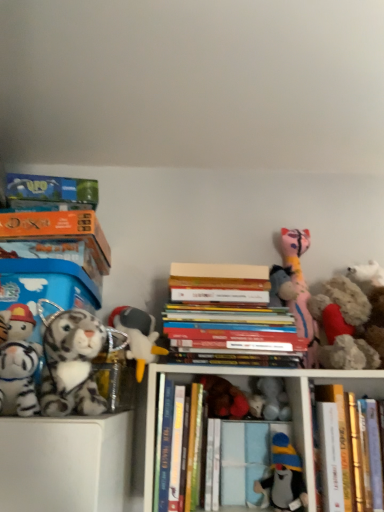
Question: Is white plush toy at center-left, the 3th toy when ordered from left to right, at the right side of fluffy white teddy bear at right, the 1th toy when ordered from right to left?

Choices:
 (A) yes
 (B) no

Answer: (B)

Question: Is white plush toy at center-left, the 3th toy when ordered from left to right, taller than fluffy white teddy bear at right, placed as the 9th toy when sorted from left to right?

Choices:
 (A) no
 (B) yes

Answer: (A)

Question: Is white plush toy at center-left, the 3th toy when ordered from left to right, not near fluffy white teddy bear at right, placed as the 9th toy when sorted from left to right?

Choices:
 (A) no
 (B) yes

Answer: (A)

Question: From a real-world perspective, is white plush toy at center-left, the 3th toy when ordered from left to right, on top of fluffy white teddy bear at right, placed as the 9th toy when sorted from left to right?

Choices:
 (A) no
 (B) yes

Answer: (A)

Question: From the image's perspective, is white plush toy at center-left, the 3th toy when ordered from left to right, located above fluffy white teddy bear at right, the 1th toy when ordered from right to left?

Choices:
 (A) no
 (B) yes

Answer: (A)

Question: From the image's perspective, would you say white plush toy at center-left, acting as the seventh toy starting from the right, is shown under fluffy white teddy bear at right, placed as the 9th toy when sorted from left to right?

Choices:
 (A) no
 (B) yes

Answer: (B)

Question: Can you confirm if white plush tiger at left, acting as the eighth toy starting from the right, is taller than matte pink plush cat at upper right, the seventh toy viewed from the left?

Choices:
 (A) no
 (B) yes

Answer: (A)

Question: Considering the relative sizes of white plush tiger at left, acting as the eighth toy starting from the right, and matte pink plush cat at upper right, the seventh toy viewed from the left, in the image provided, is white plush tiger at left, acting as the eighth toy starting from the right, shorter than matte pink plush cat at upper right, the seventh toy viewed from the left,?

Choices:
 (A) yes
 (B) no

Answer: (A)

Question: Does white plush tiger at left, which ranks as the 2th toy in left-to-right order, appear on the right side of matte pink plush cat at upper right, the seventh toy viewed from the left?

Choices:
 (A) no
 (B) yes

Answer: (A)

Question: Is white plush tiger at left, acting as the eighth toy starting from the right, not near matte pink plush cat at upper right, placed as the 3th toy when sorted from right to left?

Choices:
 (A) yes
 (B) no

Answer: (B)

Question: From the image's perspective, would you say white plush tiger at left, acting as the eighth toy starting from the right, is shown under matte pink plush cat at upper right, placed as the 3th toy when sorted from right to left?

Choices:
 (A) no
 (B) yes

Answer: (B)

Question: Does white plush tiger at left, which ranks as the 2th toy in left-to-right order, have a greater width compared to matte pink plush cat at upper right, the seventh toy viewed from the left?

Choices:
 (A) no
 (B) yes

Answer: (B)

Question: Could you tell me if white plush toy at center, marked as the fifth toy in a right-to-left arrangement, is facing fluffy beige stuffed animal at right, the eighth toy when ordered from left to right?

Choices:
 (A) yes
 (B) no

Answer: (B)